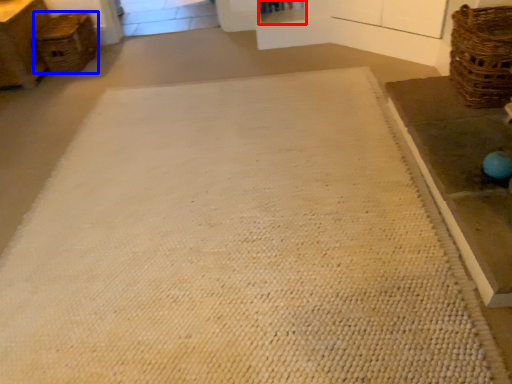
Question: Among these objects, which one is nearest to the camera, shelf (highlighted by a red box) or basket (highlighted by a blue box)?

Choices:
 (A) shelf
 (B) basket

Answer: (B)